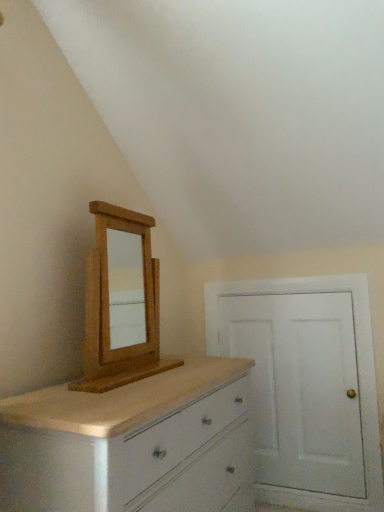
Where is `blank space situated above white painted wood door at right (from a real-world perspective)`? Image resolution: width=384 pixels, height=512 pixels. blank space situated above white painted wood door at right (from a real-world perspective) is located at coordinates (286, 294).